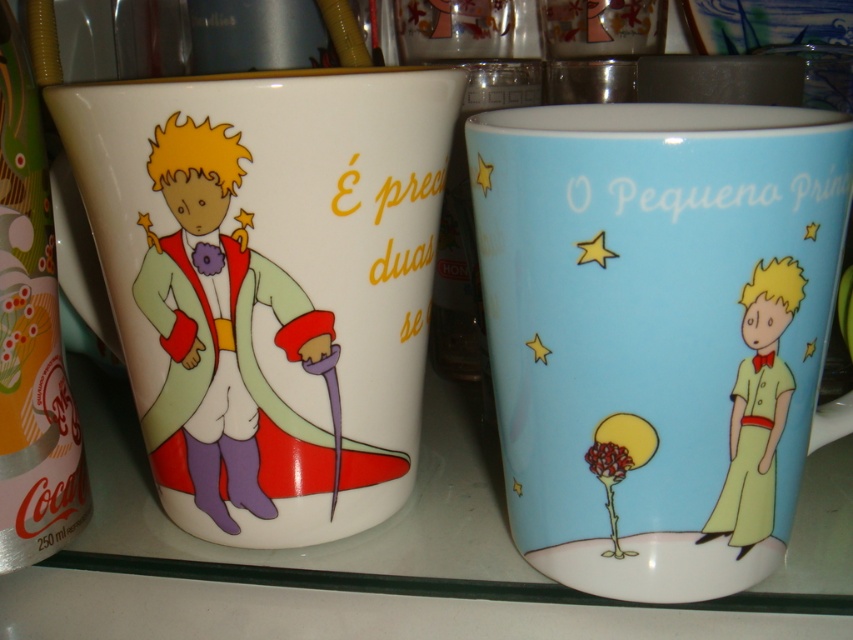
Is the position of light blue ceramic mug at center more distant than that of white glossy mug at left?

That is False.

Between point (525, 396) and point (268, 323), which one is positioned in front?

Point (525, 396) is more forward.

Between point (786, 516) and point (142, 113), which one is positioned in front?

Positioned in front is point (142, 113).

Where is `light blue ceramic mug at center`? This screenshot has height=640, width=853. light blue ceramic mug at center is located at coordinates (659, 332).